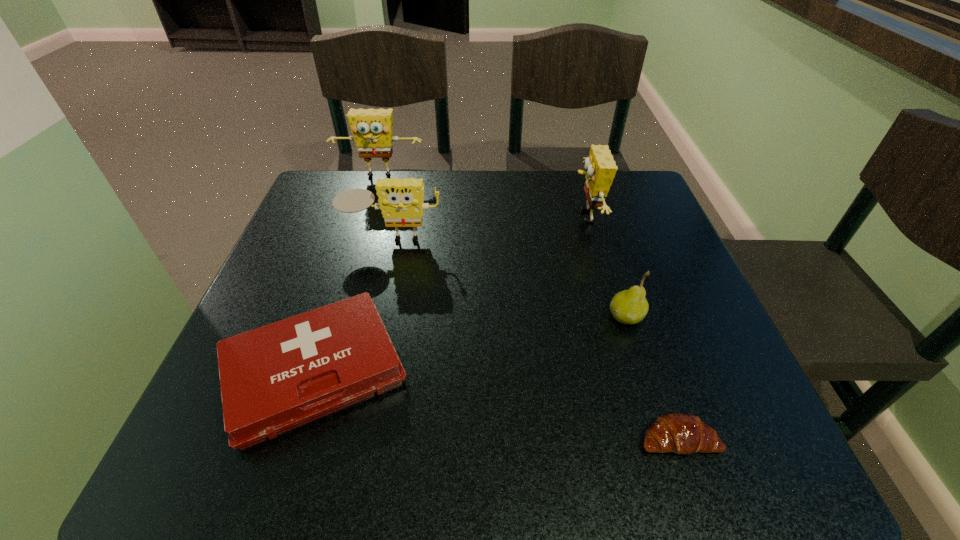
I want to click on free space between the fifth tallest object and the farthest object, so click(x=347, y=274).

Locate an element on the screen. free space between the shortest object and the pear is located at coordinates (652, 378).

You are a GUI agent. You are given a task and a screenshot of the screen. Output one action in this format:
    pyautogui.click(x=<x>, y=<y>)
    Task: Click on the fifth closest object to the second shortest object
    
    Given the screenshot: What is the action you would take?
    pyautogui.click(x=372, y=129)

Point out which object is positioned as the fifth nearest to the shortest object. Please provide its 2D coordinates. Your answer should be formatted as a tuple, i.e. [(x, y)], where the tuple contains the x and y coordinates of a point satisfying the conditions above.

[(372, 129)]

Find the location of a particular element. The width and height of the screenshot is (960, 540). sponge that is the third closest to the shortest object is located at coordinates (372, 129).

The height and width of the screenshot is (540, 960). In order to click on the closest sponge relative to the farthest object in this screenshot , I will do (x=401, y=200).

The width and height of the screenshot is (960, 540). What are the coordinates of `free spot that satisfies the following two spatial constraints: 1. on the face of the crescent roll; 2. on the right side of the rightmost sponge` in the screenshot? It's located at (648, 439).

Find the location of a particular element. The image size is (960, 540). free spot that satisfies the following two spatial constraints: 1. on the face of the fourth tallest object; 2. on the right side of the farthest sponge is located at coordinates tap(336, 317).

Identify the location of free space that satisfies the following two spatial constraints: 1. on the face of the crescent roll; 2. on the left side of the farthest object. The image size is (960, 540). (299, 439).